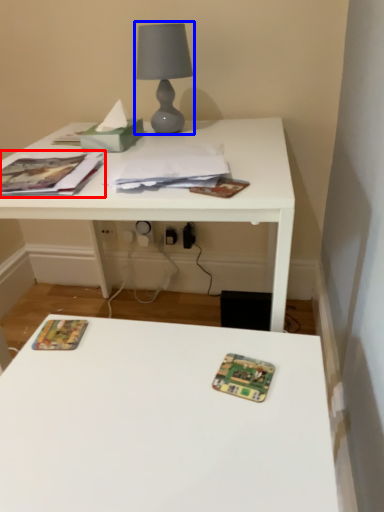
Question: Which of the following is the closest to the observer, paperback book (highlighted by a red box) or table lamp (highlighted by a blue box)?

Choices:
 (A) paperback book
 (B) table lamp

Answer: (A)